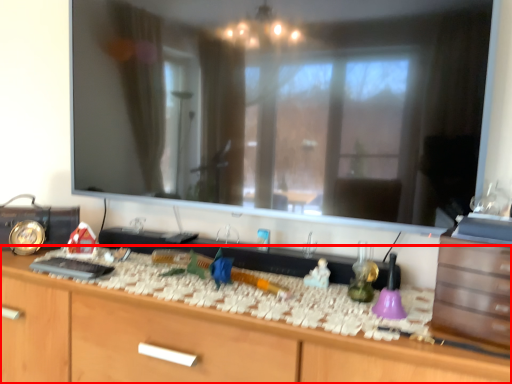
Question: From the image's perspective, what is the correct spatial positioning of cabinetry (annotated by the red box) in reference to drawer?

Choices:
 (A) below
 (B) above

Answer: (A)